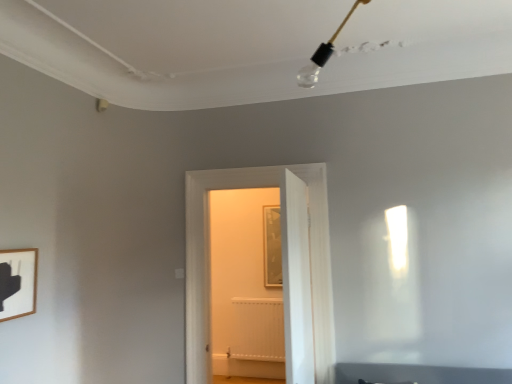
The height and width of the screenshot is (384, 512). What do you see at coordinates (18, 283) in the screenshot? I see `wooden picture frame at lower left` at bounding box center [18, 283].

The height and width of the screenshot is (384, 512). I want to click on white matte radiator at center, so pyautogui.click(x=257, y=330).

You are a GUI agent. You are given a task and a screenshot of the screen. Output one action in this format:
    pyautogui.click(x=<x>, y=<y>)
    Task: Click on the wooden picture frame at lower left
    The height and width of the screenshot is (384, 512).
    Given the screenshot: What is the action you would take?
    pyautogui.click(x=18, y=283)

Is white matte radiator at center closer to camera compared to white wooden door at center, acting as the 2th door starting from the back?

No, white matte radiator at center is behind white wooden door at center, acting as the 2th door starting from the back.

Does white matte radiator at center have a lesser width compared to white wooden door at center, acting as the 2th door starting from the back?

Indeed, white matte radiator at center has a lesser width compared to white wooden door at center, acting as the 2th door starting from the back.

Which is more to the right, white matte radiator at center or white wooden door at center, acting as the 2th door starting from the back?

white wooden door at center, acting as the 2th door starting from the back, is more to the right.

From the image's perspective, is white matte radiator at center on white wooden door at center, the first door from the front?

Incorrect, from the image's perspective, white matte radiator at center is lower than white wooden door at center, the first door from the front.

What's the angular difference between white wooden door at center, the 2th door in the front-to-back sequence, and white matte radiator at center's facing directions?

There is a 1.07-degree angle between the facing directions of white wooden door at center, the 2th door in the front-to-back sequence, and white matte radiator at center.

Find the location of a particular element. radiator behind the white wooden door at center, the first door positioned from the back is located at coordinates (257, 330).

Who is taller, white wooden door at center, the first door positioned from the back, or white matte radiator at center?

Standing taller between the two is white wooden door at center, the first door positioned from the back.

Does white wooden door at center, the 2th door in the front-to-back sequence, turn towards white matte radiator at center?

No, white wooden door at center, the 2th door in the front-to-back sequence, is not turned towards white matte radiator at center.

Considering the sizes of objects white wooden door at center, acting as the 2th door starting from the back, and white matte radiator at center in the image provided, who is bigger, white wooden door at center, acting as the 2th door starting from the back, or white matte radiator at center?

With larger size is white wooden door at center, acting as the 2th door starting from the back.

Is white wooden door at center, the first door from the front, shorter than white matte radiator at center?

No.

From a real-world perspective, is white wooden door at center, acting as the 2th door starting from the back, above or below white matte radiator at center?

Clearly, from a real-world perspective, white wooden door at center, acting as the 2th door starting from the back, is above white matte radiator at center.

How different are the orientations of wooden picture frame at lower left and white wooden door at center, the 2th door in the front-to-back sequence, in degrees?

89.6 degrees separate the facing orientations of wooden picture frame at lower left and white wooden door at center, the 2th door in the front-to-back sequence.

Which object is more forward, wooden picture frame at lower left or white wooden door at center, the first door positioned from the back?

wooden picture frame at lower left is more forward.

Where is `picture frame located on the left of white wooden door at center, the first door positioned from the back`? The height and width of the screenshot is (384, 512). picture frame located on the left of white wooden door at center, the first door positioned from the back is located at coordinates (18, 283).

Which of these two, white wooden door at center, the 2th door in the front-to-back sequence, or white wooden door at center, the first door from the front, stands taller?

white wooden door at center, the 2th door in the front-to-back sequence, is taller.

Considering the relative sizes of white wooden door at center, the 2th door in the front-to-back sequence, and white wooden door at center, acting as the 2th door starting from the back, in the image provided, is white wooden door at center, the 2th door in the front-to-back sequence, wider than white wooden door at center, acting as the 2th door starting from the back,?

Correct, the width of white wooden door at center, the 2th door in the front-to-back sequence, exceeds that of white wooden door at center, acting as the 2th door starting from the back.

Are white wooden door at center, the 2th door in the front-to-back sequence, and white wooden door at center, the first door from the front, far apart?

No, white wooden door at center, the 2th door in the front-to-back sequence, is not far away from white wooden door at center, the first door from the front.

Which is behind, point (259, 298) or point (13, 281)?

The point (259, 298) is behind.

From the image's perspective, which one is positioned lower, white matte radiator at center or wooden picture frame at lower left?

white matte radiator at center is shown below in the image.

Which of these two, white matte radiator at center or wooden picture frame at lower left, stands taller?

white matte radiator at center is taller.

Would you say white matte radiator at center is outside wooden picture frame at lower left?

Yes, white matte radiator at center is located beyond the bounds of wooden picture frame at lower left.

Is white wooden door at center, the first door positioned from the back, in front of or behind wooden picture frame at lower left in the image?

In the image, white wooden door at center, the first door positioned from the back, appears behind wooden picture frame at lower left.

Which is closer to the camera, (190, 253) or (32, 313)?

Point (190, 253).

From the image's perspective, would you say white wooden door at center, the 2th door in the front-to-back sequence, is shown under wooden picture frame at lower left?

Yes, from the image's perspective, white wooden door at center, the 2th door in the front-to-back sequence, is below wooden picture frame at lower left.

Looking at this image, which of these two, white wooden door at center, the 2th door in the front-to-back sequence, or wooden picture frame at lower left, is thinner?

Result: Thinner between the two is wooden picture frame at lower left.

At what (x,y) coordinates should I click in order to perform the action: click on radiator below the white wooden door at center, acting as the 2th door starting from the back (from a real-world perspective). Please return your answer as a coordinate pair (x, y). The image size is (512, 384). Looking at the image, I should click on (257, 330).

At what (x,y) coordinates should I click in order to perform the action: click on door that is the 2nd object above the white matte radiator at center (from a real-world perspective). Please return your answer as a coordinate pair (x, y). The width and height of the screenshot is (512, 384). Looking at the image, I should click on (207, 258).

Considering their positions, is white wooden door at center, the 2th door in the front-to-back sequence, positioned further to white matte radiator at center than white wooden door at center, the first door from the front?

→ white wooden door at center, the first door from the front.

Looking at the image, which one is located further to wooden picture frame at lower left, white matte radiator at center or white wooden door at center, acting as the 2th door starting from the back?

Based on the image, white matte radiator at center appears to be further to wooden picture frame at lower left.

When comparing their distances from white wooden door at center, the first door positioned from the back, does white matte radiator at center or white wooden door at center, acting as the 2th door starting from the back, seem closer?

white wooden door at center, acting as the 2th door starting from the back, is closer to white wooden door at center, the first door positioned from the back.

Looking at the image, which one is located closer to white wooden door at center, acting as the 2th door starting from the back, wooden picture frame at lower left or white matte radiator at center?

Based on the image, white matte radiator at center appears to be nearer to white wooden door at center, acting as the 2th door starting from the back.

Based on their spatial positions, is wooden picture frame at lower left or white wooden door at center, the 2th door in the front-to-back sequence, closer to white matte radiator at center?

white wooden door at center, the 2th door in the front-to-back sequence, lies closer to white matte radiator at center than the other object.

Considering their positions, is wooden picture frame at lower left positioned further to white matte radiator at center than white wooden door at center, acting as the 2th door starting from the back?

wooden picture frame at lower left.

When comparing their distances from white wooden door at center, the first door positioned from the back, does white matte radiator at center or wooden picture frame at lower left seem further?

white matte radiator at center is positioned further to the anchor white wooden door at center, the first door positioned from the back.

Considering their positions, is white matte radiator at center positioned closer to wooden picture frame at lower left than white wooden door at center, the 2th door in the front-to-back sequence?

white wooden door at center, the 2th door in the front-to-back sequence.

Where is `door between wooden picture frame at lower left and white wooden door at center, the first door from the front, from left to right`? door between wooden picture frame at lower left and white wooden door at center, the first door from the front, from left to right is located at coordinates (207, 258).

Locate an element on the screen. This screenshot has height=384, width=512. door between white wooden door at center, acting as the 2th door starting from the back, and white matte radiator at center from front to back is located at coordinates (207, 258).